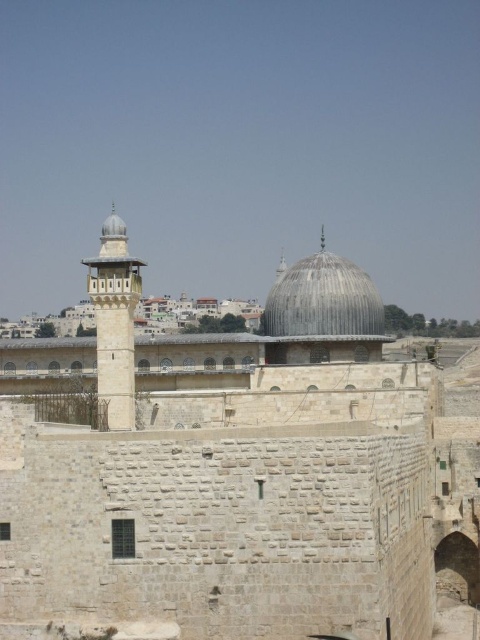
Who is more forward, (360, 563) or (348, 326)?

Point (360, 563) is more forward.

Who is shorter, stone dome at center or gray stone dome at center?

Standing shorter between the two is gray stone dome at center.

This screenshot has width=480, height=640. In order to click on stone dome at center in this screenshot , I will do `click(235, 472)`.